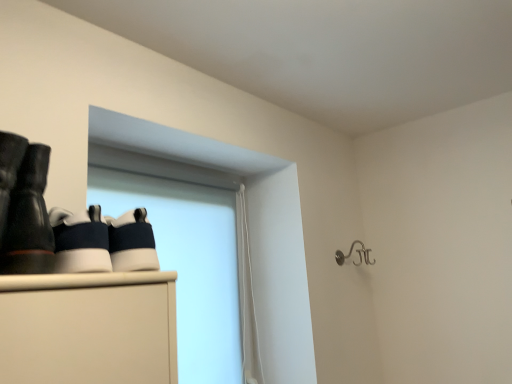
Question: Is white matte window screen at upper left shorter than silver metallic hook at upper right?

Choices:
 (A) yes
 (B) no

Answer: (B)

Question: Considering the relative sizes of white matte window screen at upper left and silver metallic hook at upper right in the image provided, is white matte window screen at upper left taller than silver metallic hook at upper right?

Choices:
 (A) no
 (B) yes

Answer: (B)

Question: Can you confirm if white matte window screen at upper left is positioned to the right of silver metallic hook at upper right?

Choices:
 (A) yes
 (B) no

Answer: (B)

Question: From the image's perspective, is white matte window screen at upper left located above silver metallic hook at upper right?

Choices:
 (A) no
 (B) yes

Answer: (A)

Question: Are white matte window screen at upper left and silver metallic hook at upper right making contact?

Choices:
 (A) yes
 (B) no

Answer: (B)

Question: Is white matte window screen at upper left smaller than silver metallic hook at upper right?

Choices:
 (A) yes
 (B) no

Answer: (B)

Question: Is matte black boots at left positioned in front of white matte window screen at upper left?

Choices:
 (A) yes
 (B) no

Answer: (A)

Question: Is matte black boots at left bigger than white matte window screen at upper left?

Choices:
 (A) yes
 (B) no

Answer: (B)

Question: From the image's perspective, does matte black boots at left appear lower than white matte window screen at upper left?

Choices:
 (A) no
 (B) yes

Answer: (A)

Question: Does matte black boots at left have a lesser height compared to white matte window screen at upper left?

Choices:
 (A) no
 (B) yes

Answer: (B)

Question: Can you confirm if matte black boots at left is positioned to the left of white matte window screen at upper left?

Choices:
 (A) no
 (B) yes

Answer: (B)

Question: Does matte black boots at left appear on the right side of white matte window screen at upper left?

Choices:
 (A) yes
 (B) no

Answer: (B)

Question: Does silver metallic hook at upper right appear on the left side of white matte window screen at upper left?

Choices:
 (A) no
 (B) yes

Answer: (A)